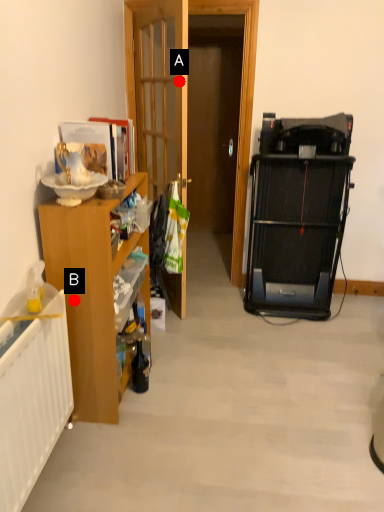
Question: Two points are circled on the image, labeled by A and B beside each circle. Which point appears closest to the camera in this image?

Choices:
 (A) A is closer
 (B) B is closer

Answer: (B)